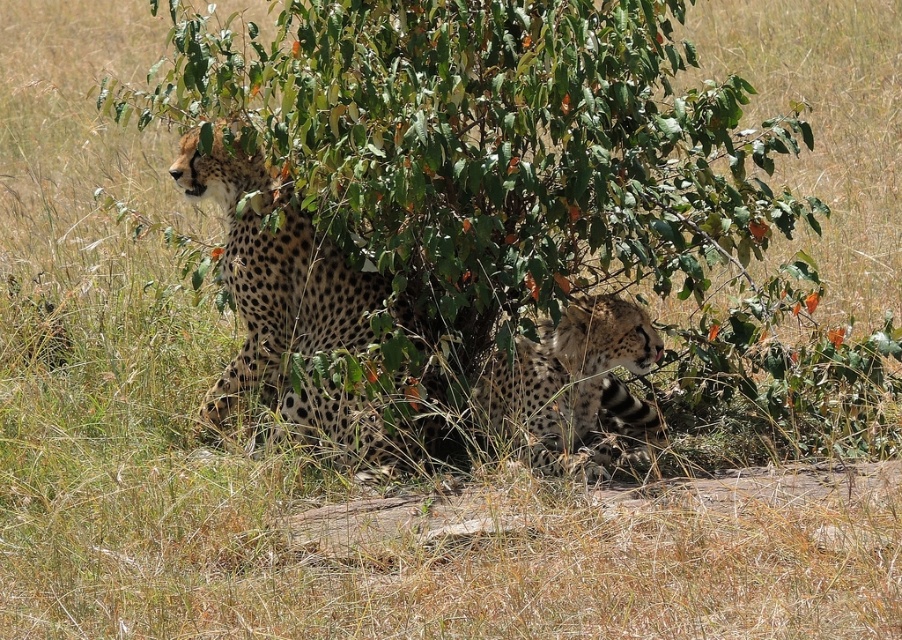
Based on the photo, you are a wildlife photographer trying to capture a photo of both spotted fur cheetah at center and spotted fur cheetah at lower right. Since you want to ensure both are in focus, you need to know which one is bigger. Can you tell me which cheetah is larger?

The spotted fur cheetah at center is larger compared to the spotted fur cheetah at lower right.

You are a wildlife photographer trying to capture a photo of both spotted fur cheetah at center and spotted fur cheetah at lower right. Based on their positions, which cheetah is positioned further away from the camera?

The spotted fur cheetah at lower right is positioned further away from the camera than the spotted fur cheetah at center because the description states that the one at center might be wider, implying it is closer.

You are a wildlife photographer trying to capture an image of the spotted fur cheetah at center. You notice a point at coordinates (297, 314) in the frame. Based on the scene description, can you confirm if this point is located on the spotted fur cheetah at center?

Yes, the point at coordinates (297, 314) is located on the spotted fur cheetah at center, as the Objects Description specifies that this point indicates the spotted fur cheetah at center.